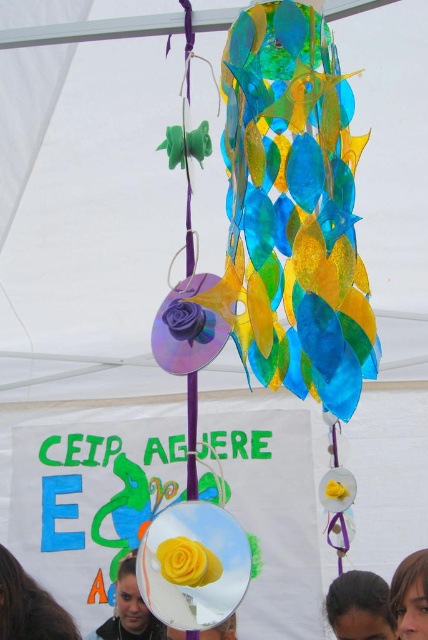
From the picture: You are looking at the wind chime decoration and notice two strands of brown hair. Which one is closer to you, the brown hair at lower left or the smooth brown hair at lower right?

The brown hair at lower left is closer to you because it is further to the viewer than the smooth brown hair at lower right.

What is the exact position of the brown hair at lower left in the image?

The brown hair at lower left is located at point coordinates of (29, 605).

You are a photographer taking a portrait of someone standing under the wind chime decoration. You notice the brown hair at lower left and the smooth skin face at lower center. Which object is positioned higher in the image?

The brown hair at lower left is above the smooth skin face at lower center, so the brown hair at lower left is positioned higher in the image.